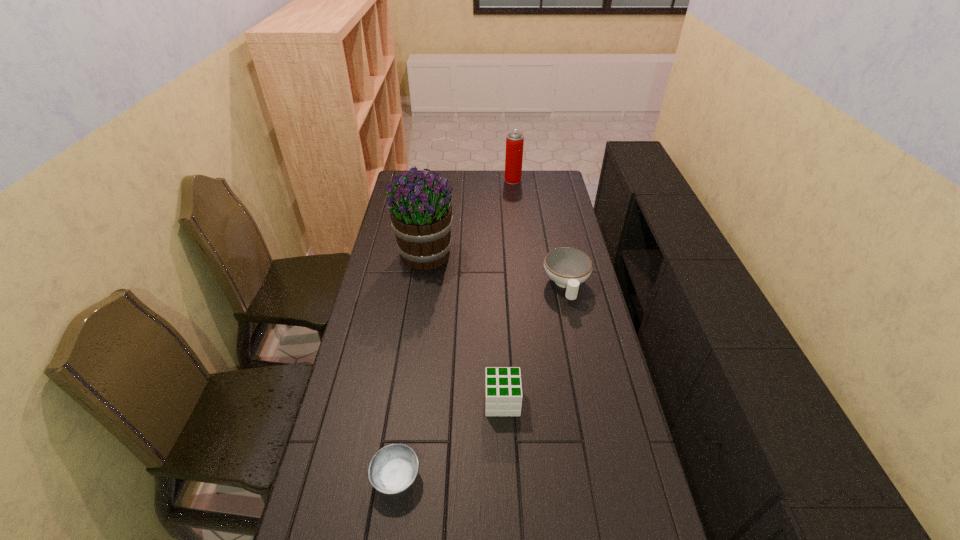
Where is `vacant space at the left edge`? The width and height of the screenshot is (960, 540). vacant space at the left edge is located at coordinates (395, 294).

This screenshot has width=960, height=540. In the image, there is a desktop. Find the location of `vacant space at the right edge`. vacant space at the right edge is located at coordinates (578, 388).

The image size is (960, 540). What are the coordinates of `vacant space at the far right corner of the desktop` in the screenshot? It's located at (549, 171).

Identify the location of empty location between the nearest object and the third object from left to right. (449, 440).

The width and height of the screenshot is (960, 540). I want to click on blank region between the tallest object and the ashtray, so click(411, 366).

This screenshot has width=960, height=540. In order to click on vacant area that lies between the nearest object and the third object from left to right in this screenshot , I will do pyautogui.click(x=449, y=440).

You are a GUI agent. You are given a task and a screenshot of the screen. Output one action in this format:
    pyautogui.click(x=<x>, y=<y>)
    Task: Click on the free spot between the second object from right to left and the nearest object
    
    Given the screenshot: What is the action you would take?
    pyautogui.click(x=455, y=329)

The height and width of the screenshot is (540, 960). In order to click on vacant space that is in between the chinaware and the nearest object in this screenshot , I will do `click(481, 381)`.

Where is `free area in between the bouquet and the third object from left to right`? The width and height of the screenshot is (960, 540). free area in between the bouquet and the third object from left to right is located at coordinates (464, 328).

You are a GUI agent. You are given a task and a screenshot of the screen. Output one action in this format:
    pyautogui.click(x=<x>, y=<y>)
    Task: Click on the free spot between the aerosol can and the chinaware
    
    Given the screenshot: What is the action you would take?
    pyautogui.click(x=540, y=233)